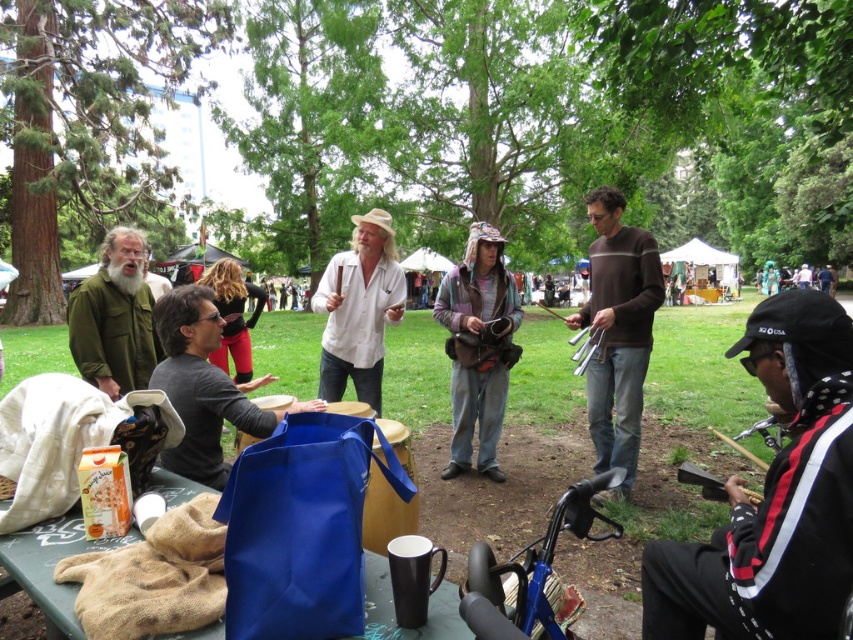
Looking at this image, you are standing in the park and want to hand an item to the person wearing the black and white jacket at lower right. You have two items to choose from the scene. Which item should you pick to ensure it reaches them without needing to move past the matte black bag at center?

The black and white jacket at lower right is closer to the viewer than the matte black bag at center, so you should choose an item that is already near the black and white jacket at lower right to avoid moving past the matte black bag at center.

You are a photographer standing at the edge of the park scene. You need to capture a photo where both the blue fabric bag at lower center and the white cotton shirt at center are clearly visible. Based on their positions, which object should you ensure is in the lower part of your photo frame?

The blue fabric bag at lower center should be placed in the lower part of the photo frame since it is positioned below the white cotton shirt at center.